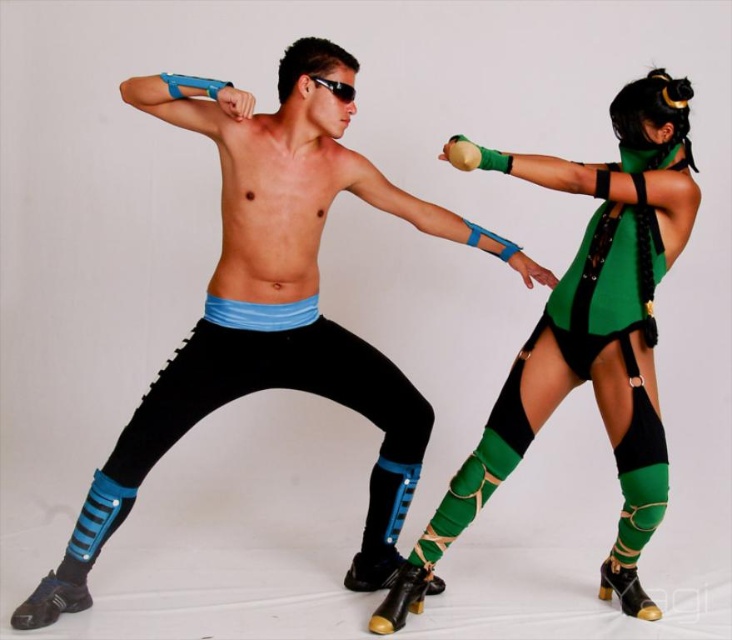
Locate an element on the screen. The height and width of the screenshot is (640, 732). black matte pants at center is located at coordinates (272, 305).

Who is positioned more to the left, black matte pants at center or green matte/leather outfit at upper right?

black matte pants at center

Does point (272, 253) come behind point (489, 461)?

No, it is not.

Where is `black matte pants at center`? This screenshot has width=732, height=640. black matte pants at center is located at coordinates (272, 305).